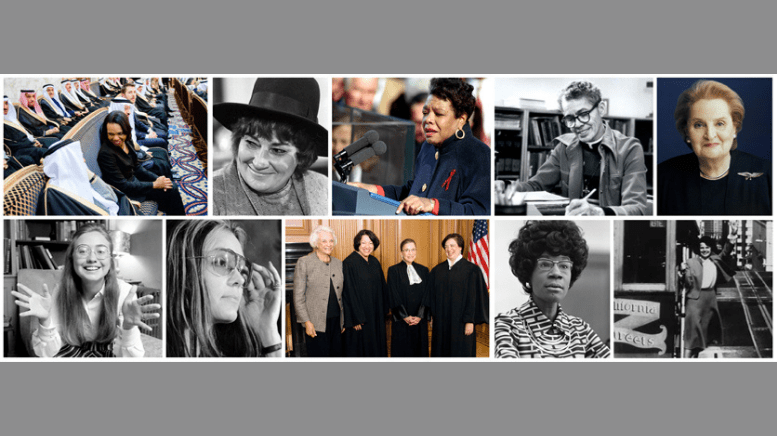
Identify the location of books. This screenshot has height=436, width=777. click(x=548, y=135), click(x=633, y=130).